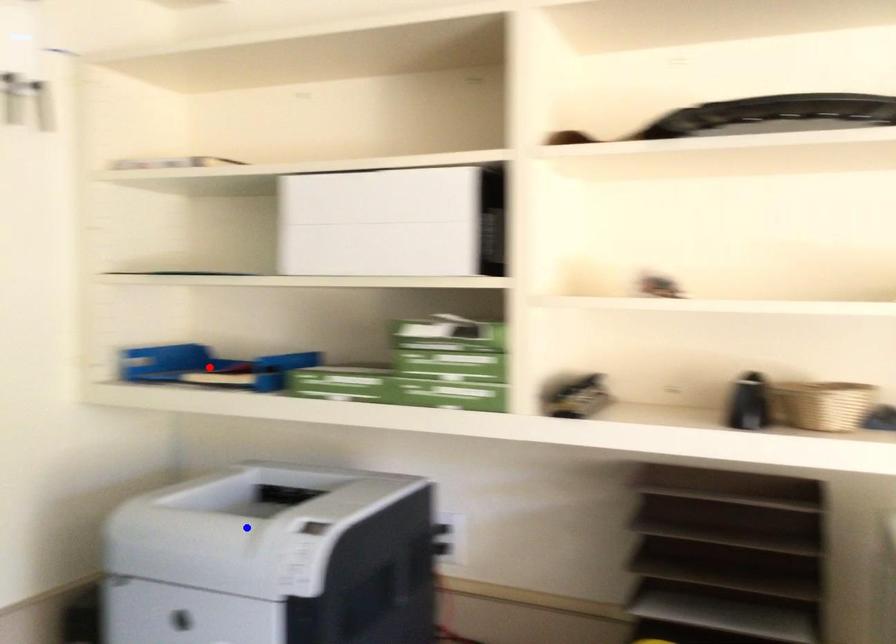
Question: Two points are marked on the image. Which point is closer to the camera?

Choices:
 (A) Blue point is closer.
 (B) Red point is closer.

Answer: (A)